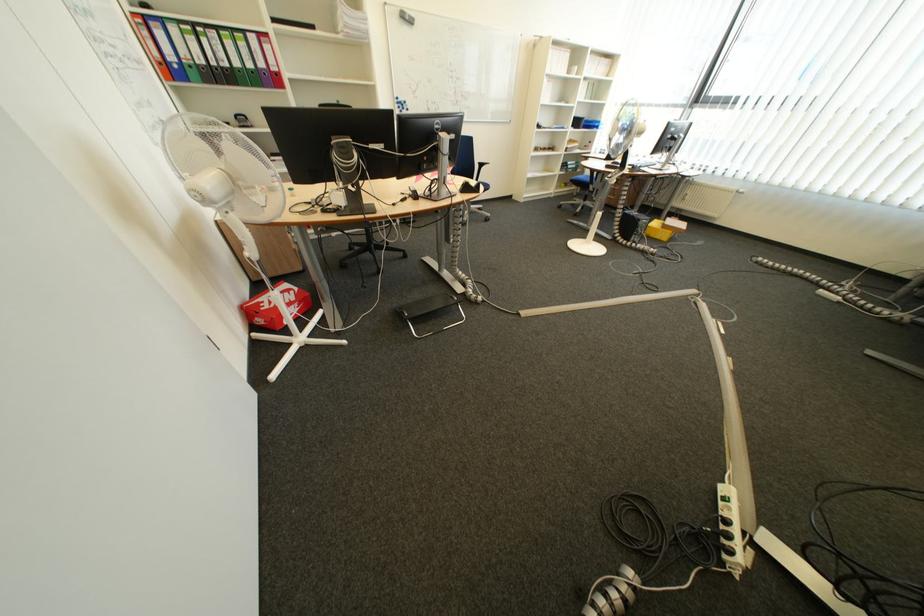
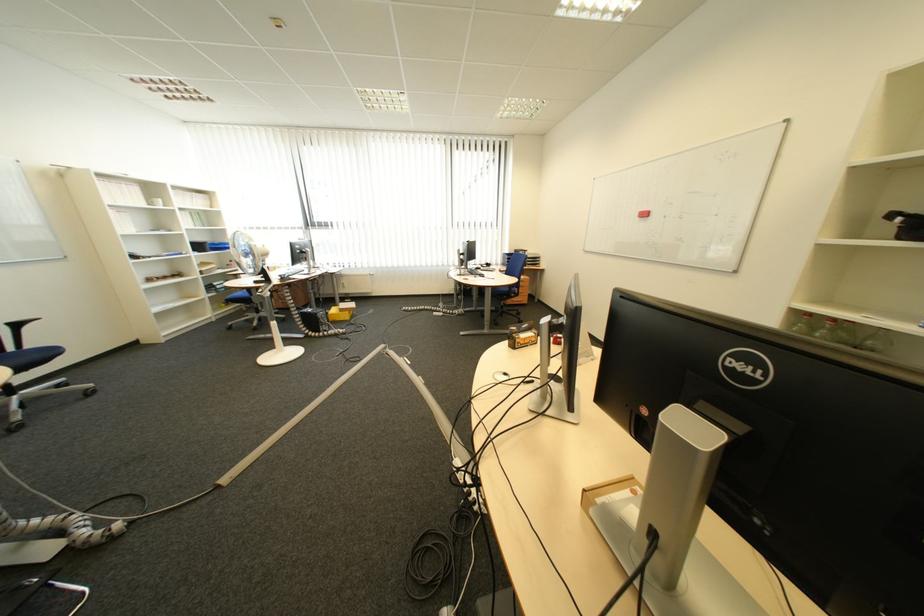
Question: The first image is from the beginning of the video and the second image is from the end. How did the camera likely rotate when shooting the video?

Choices:
 (A) Left
 (B) Right
 (C) Up
 (D) Down

Answer: (B)